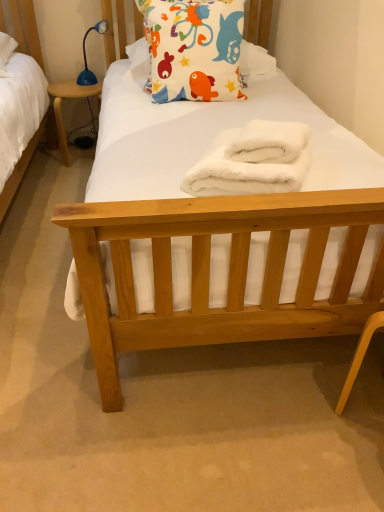
Question: Is white fluffy bath towel at center in front of or behind blue plastic lamp at upper left in the image?

Choices:
 (A) front
 (B) behind

Answer: (A)

Question: From a real-world perspective, is white fluffy bath towel at center positioned above or below blue plastic lamp at upper left?

Choices:
 (A) above
 (B) below

Answer: (A)

Question: Based on their relative distances, which object is nearer to the blue plastic lamp at upper left?

Choices:
 (A) white fabric pillow with colorful fish designs at upper center
 (B) white fluffy towel at center
 (C) blue plastic desk at left
 (D) white fluffy bath towel at center

Answer: (C)

Question: Estimate the real-world distances between objects in this image. Which object is farther from the white fabric pillow with colorful fish designs at upper center?

Choices:
 (A) white fluffy bath towel at center
 (B) blue plastic desk at left
 (C) white fluffy towel at center
 (D) blue plastic lamp at upper left

Answer: (D)